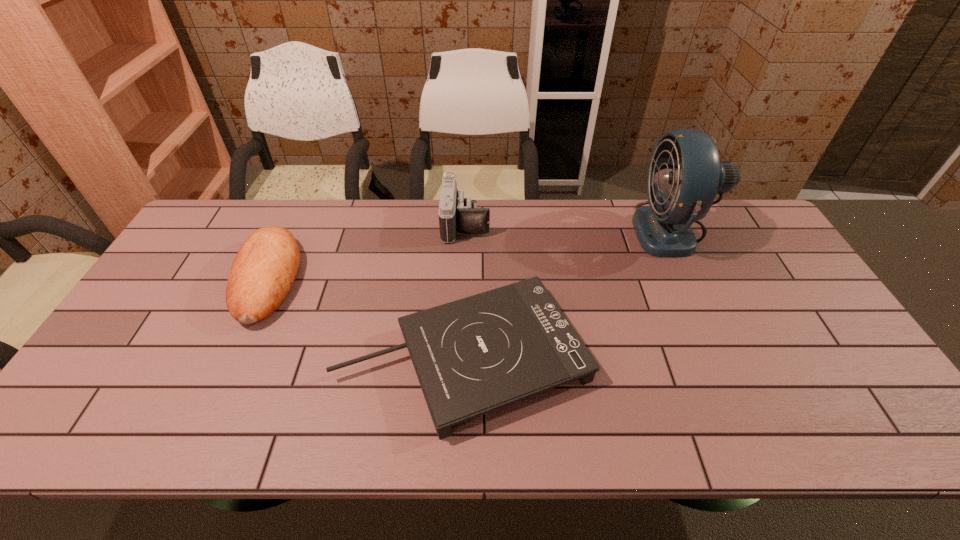
The width and height of the screenshot is (960, 540). What are the coordinates of `vacant space located 0.180m on the left of the leftmost object` in the screenshot? It's located at [x=177, y=279].

Locate an element on the screen. This screenshot has height=540, width=960. free space located on the left of the hotplate is located at coordinates (309, 356).

Locate an element on the screen. The height and width of the screenshot is (540, 960). fan positioned at the far edge is located at coordinates (678, 196).

Locate an element on the screen. Image resolution: width=960 pixels, height=540 pixels. camera situated at the far edge is located at coordinates (456, 214).

Where is `bread that is at the far edge`? This screenshot has height=540, width=960. bread that is at the far edge is located at coordinates (264, 269).

Find the location of a particular element. The width and height of the screenshot is (960, 540). object that is at the near edge is located at coordinates (474, 355).

You are a GUI agent. You are given a task and a screenshot of the screen. Output one action in this format:
    pyautogui.click(x=<x>, y=<y>)
    Task: Click on the vacant region at the far edge of the desktop
    The height and width of the screenshot is (540, 960).
    Given the screenshot: What is the action you would take?
    pyautogui.click(x=490, y=215)

The height and width of the screenshot is (540, 960). I want to click on vacant space at the near edge, so click(x=543, y=413).

The height and width of the screenshot is (540, 960). In the image, there is a desktop. What are the coordinates of `vacant region at the left edge` in the screenshot? It's located at (224, 253).

At what (x,y) coordinates should I click in order to perform the action: click on free space at the far left corner of the desktop. Please return your answer as a coordinate pair (x, y). The image size is (960, 540). Looking at the image, I should click on (229, 227).